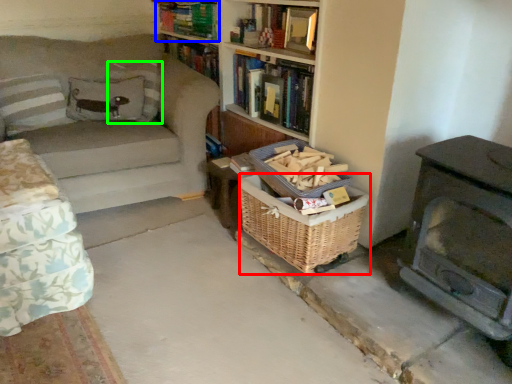
Question: Which is farther away from basket (highlighted by a red box)? book (highlighted by a blue box) or pillow (highlighted by a green box)?

Choices:
 (A) book
 (B) pillow

Answer: (A)